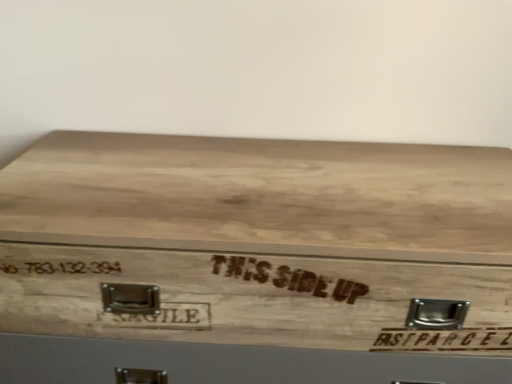
Question: Should I look upward or downward to see natural wood box at center?

Choices:
 (A) up
 (B) down

Answer: (B)